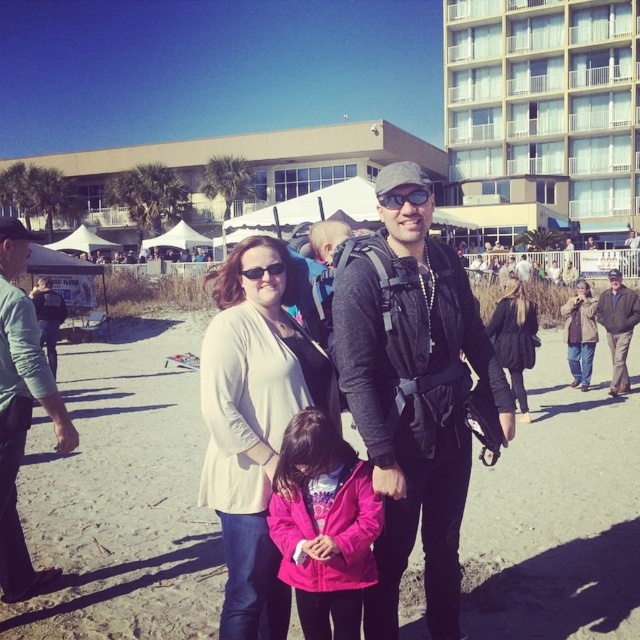
Question: Is pink matte jacket at center above khaki cotton jacket at right?

Choices:
 (A) yes
 (B) no

Answer: (B)

Question: Which point is farther to the camera?

Choices:
 (A) clear plastic goggles at center
 (B) beige concrete building at upper center
 (C) matte black sunglasses at center
 (D) pink matte jacket at center

Answer: (B)

Question: Which point is closer to the camera taking this photo?

Choices:
 (A) (636, 307)
 (B) (227, 554)
 (C) (376, 355)
 (D) (621, 93)

Answer: (C)

Question: Considering the relative positions of black matte jacket at center and pink matte jacket at center in the image provided, where is black matte jacket at center located with respect to pink matte jacket at center?

Choices:
 (A) left
 (B) right

Answer: (B)

Question: Can you confirm if pink fabric jacket at center is positioned below matte black sunglasses at center?

Choices:
 (A) yes
 (B) no

Answer: (A)

Question: Which of the following is the farthest from the observer?

Choices:
 (A) (456, 332)
 (B) (42, 384)

Answer: (B)